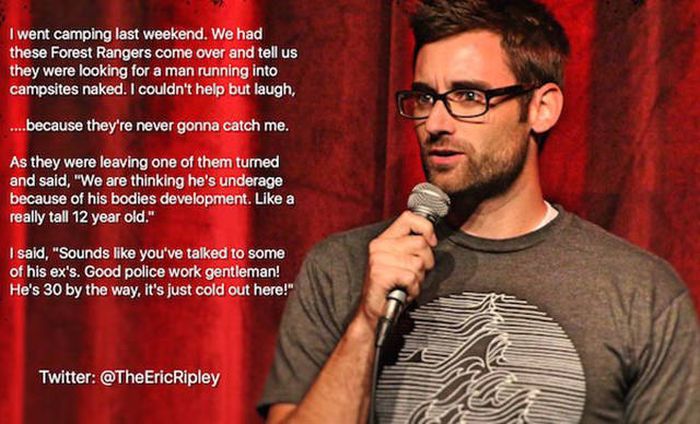
The width and height of the screenshot is (700, 424). I want to click on red curtain, so click(346, 191).